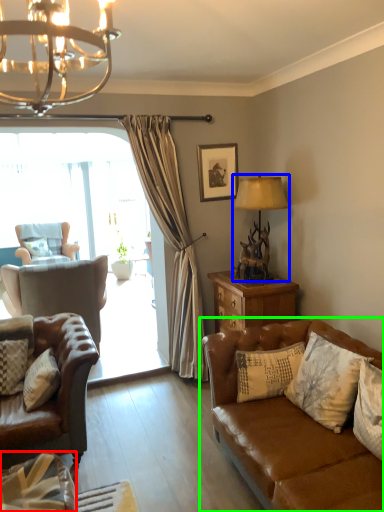
Question: Considering the real-world distances, which object is closest to pillow (highlighted by a red box)? lamp (highlighted by a blue box) or studio couch (highlighted by a green box).

Choices:
 (A) lamp
 (B) studio couch

Answer: (B)